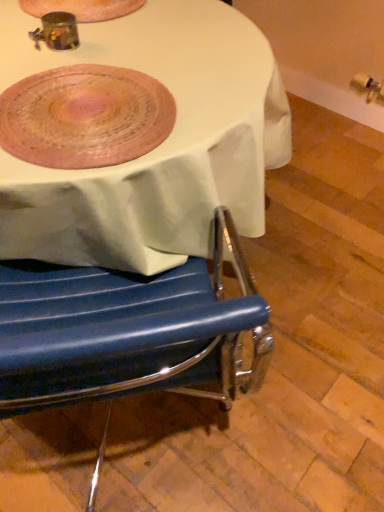
What do you see at coordinates (85, 117) in the screenshot?
I see `pink woven platter at upper left` at bounding box center [85, 117].

Locate an element on the screen. This screenshot has width=384, height=512. pink woven platter at upper left is located at coordinates (85, 117).

What is the approximate height of pink woven platter at upper left?

pink woven platter at upper left is 1.47 inches in height.

Measure the distance between pink woven platter at upper left and camera.

They are 29.25 inches apart.

The width and height of the screenshot is (384, 512). Find the location of `blue leather chair at lower left`. blue leather chair at lower left is located at coordinates (127, 331).

What do you see at coordinates (127, 331) in the screenshot?
I see `blue leather chair at lower left` at bounding box center [127, 331].

The image size is (384, 512). Find the location of `pink woven platter at upper left`. pink woven platter at upper left is located at coordinates (85, 117).

In the scene shown: Is blue leather chair at lower left to the left of pink woven platter at upper left from the viewer's perspective?

In fact, blue leather chair at lower left is to the right of pink woven platter at upper left.

Is blue leather chair at lower left further to camera compared to pink woven platter at upper left?

Yes, blue leather chair at lower left is further from the camera.

Which point is more distant from viewer, (104, 296) or (82, 76)?

The point (104, 296) is farther from the camera.

From the image's perspective, between blue leather chair at lower left and pink woven platter at upper left, which one is located above?

From the image's view, pink woven platter at upper left is above.

From a real-world perspective, which is physically below, blue leather chair at lower left or pink woven platter at upper left?

blue leather chair at lower left.

Considering the sizes of objects blue leather chair at lower left and pink woven platter at upper left in the image provided, who is wider, blue leather chair at lower left or pink woven platter at upper left?

Wider between the two is blue leather chair at lower left.

Who is taller, blue leather chair at lower left or pink woven platter at upper left?

blue leather chair at lower left.

Considering the sizes of blue leather chair at lower left and pink woven platter at upper left in the image, is blue leather chair at lower left bigger or smaller than pink woven platter at upper left?

Considering their sizes, blue leather chair at lower left takes up more space than pink woven platter at upper left.

Would you say pink woven platter at upper left is part of blue leather chair at lower left's contents?

No.

Are blue leather chair at lower left and pink woven platter at upper left making contact?

No, blue leather chair at lower left is not next to pink woven platter at upper left.

Is blue leather chair at lower left oriented towards pink woven platter at upper left?

No, blue leather chair at lower left is not facing towards pink woven platter at upper left.

How different are the orientations of blue leather chair at lower left and pink woven platter at upper left in degrees?

The angular difference between blue leather chair at lower left and pink woven platter at upper left is 139 degrees.

Identify the location of chair directly beneath the pink woven platter at upper left (from a real-world perspective). (127, 331).

Can you confirm if pink woven platter at upper left is positioned to the left of blue leather chair at lower left?

Yes, pink woven platter at upper left is to the left of blue leather chair at lower left.

Is pink woven platter at upper left in front of or behind blue leather chair at lower left in the image?

In the image, pink woven platter at upper left appears in front of blue leather chair at lower left.

Which is nearer, (46, 79) or (163, 372)?

Point (46, 79).

Looking at this image, from the image's perspective, relative to blue leather chair at lower left, is pink woven platter at upper left above or below?

From the image's perspective, pink woven platter at upper left appears above blue leather chair at lower left.

From a real-world perspective, which object stands above the other?

pink woven platter at upper left, from a real-world perspective.

Considering the sizes of pink woven platter at upper left and blue leather chair at lower left in the image, is pink woven platter at upper left wider or thinner than blue leather chair at lower left?

Clearly, pink woven platter at upper left has less width compared to blue leather chair at lower left.

Is pink woven platter at upper left shorter than blue leather chair at lower left?

Yes, pink woven platter at upper left is shorter than blue leather chair at lower left.

Can you confirm if pink woven platter at upper left is smaller than blue leather chair at lower left?

Yes.

Is pink woven platter at upper left completely or partially outside of blue leather chair at lower left?

Yes, pink woven platter at upper left is not within blue leather chair at lower left.

Would you say pink woven platter at upper left is a long distance from blue leather chair at lower left?

No, there isn't a large distance between pink woven platter at upper left and blue leather chair at lower left.

Is pink woven platter at upper left facing towards blue leather chair at lower left?

No.

In order to click on platter above the blue leather chair at lower left (from a real-world perspective) in this screenshot , I will do `click(85, 117)`.

Find the location of a particular element. The image size is (384, 512). platter in front of the blue leather chair at lower left is located at coordinates (85, 117).

Find the location of a particular element. The image size is (384, 512). chair lying below the pink woven platter at upper left (from the image's perspective) is located at coordinates (127, 331).